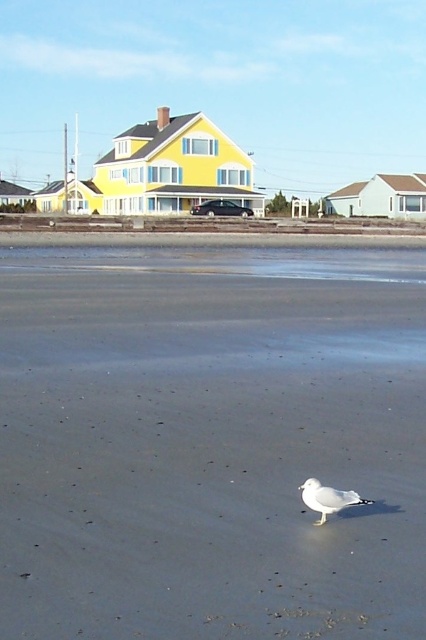
You are a photographer trying to capture the white matte bird at center and the smooth gray sand at center in a single shot. Which object will occupy more space in the photo?

The smooth gray sand at center is bigger than the white matte bird at center, so it will occupy more space in the photo.

You are standing on the beach and see the smooth gray sand at center and the white matte bird at center. Which object is closer to you?

The white matte bird at center is closer to you because it is located below the smooth gray sand at center, which is above it.